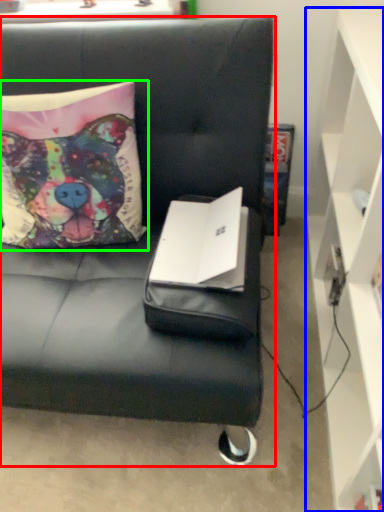
Question: Based on their relative distances, which object is nearer to studio couch (highlighted by a red box)? Choose from cabinetry (highlighted by a blue box) and pillow (highlighted by a green box).

Choices:
 (A) cabinetry
 (B) pillow

Answer: (B)